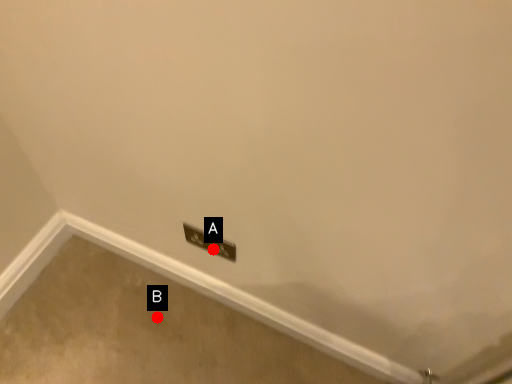
Question: Two points are circled on the image, labeled by A and B beside each circle. Among these points, which one is farthest from the camera?

Choices:
 (A) A is further
 (B) B is further

Answer: (B)